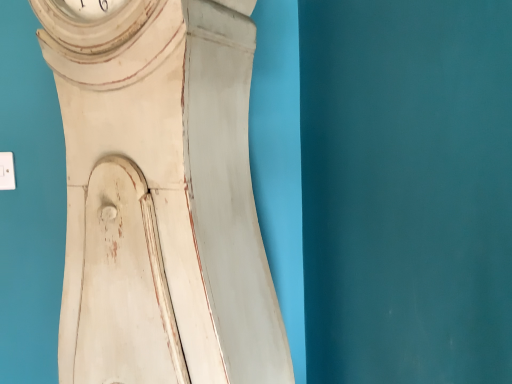
The image size is (512, 384). In order to click on white distressed wood clock at upper left in this screenshot , I will do `click(160, 196)`.

What is the approximate height of white distressed wood clock at upper left?

The height of white distressed wood clock at upper left is 37.43 inches.

Describe the element at coordinates (160, 196) in the screenshot. I see `white distressed wood clock at upper left` at that location.

Find the location of a particular element. The width and height of the screenshot is (512, 384). white distressed wood clock at upper left is located at coordinates (160, 196).